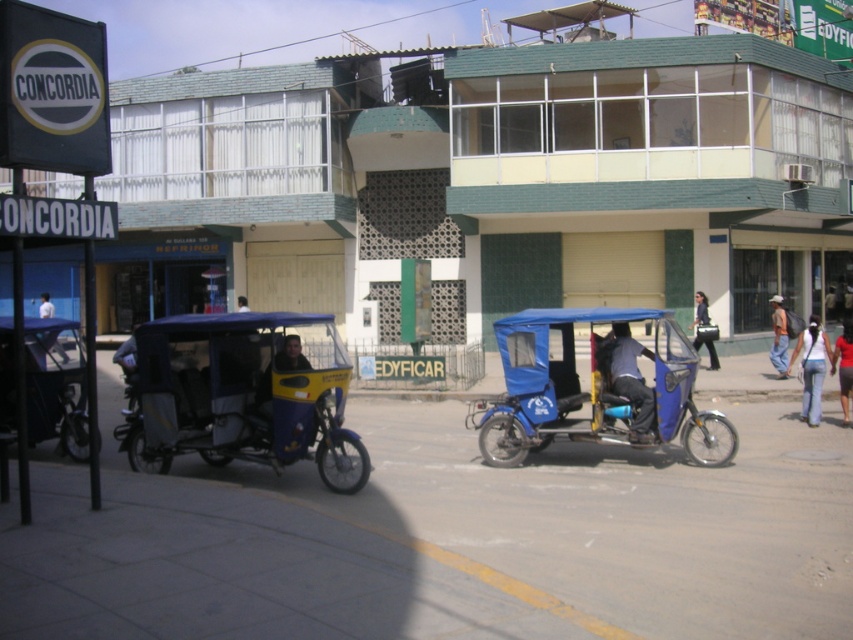
You are a tourist standing in the street scene described. You see a brown fabric backpack at right. Where is the brown fabric backpack located in the image?

The brown fabric backpack at right is located at the coordinates point (778, 337) in the image.

You are standing at the point with coordinates point (244, 307) and want to see if you can see the point (843, 417) from your current position. Considering the street scene with two tuk tuks and the building in the background, can you see it?

Point (843, 417) is in front of point (244, 307), so yes, you can see point (843, 417) from your current position at point (244, 307) because it is closer to you.